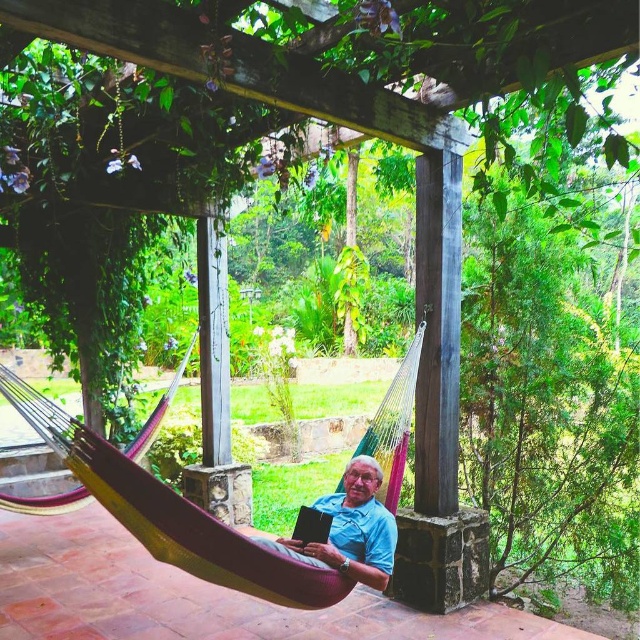
From the picture: You are standing at the base of the pergola and want to walk towards the hammock. There are two points marked on the ground where you need to step carefully. The first point is at coordinate point(163, 509) and the second point is at coordinate point(349, 499). Which point should you step on first to reach the hammock safely?

You should step on point(163, 509) first because it is in front of point(349, 499), so stepping on the closer point first will help you move towards the hammock safely.

Based on the photo, you are planning to place a blue cotton shirt at center on a multicolored fabric hammock at center. Based on their sizes, will the shirt be fully visible once placed on the hammock?

The multicolored fabric hammock at center is larger in size than the blue cotton shirt at center, so the shirt will be fully visible once placed on the hammock.

You are a photographer setting up a shot of the multicolored fabric hammock at center and the blue cotton shirt at center. You need to ensure that the taller object is in focus first. Which object should you focus on first?

The multicolored fabric hammock at center is taller than the blue cotton shirt at center, so you should focus on the multicolored fabric hammock at center first.